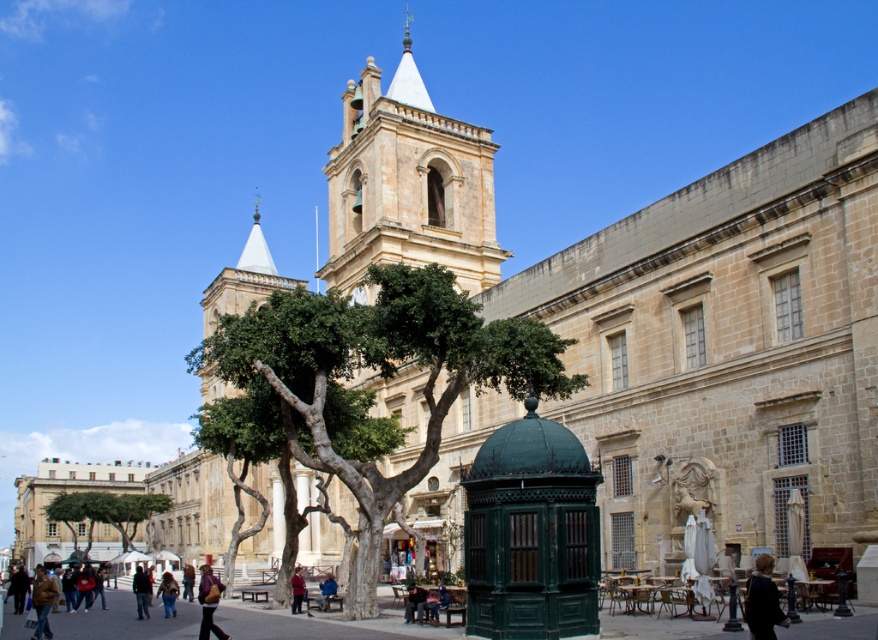
Question: Does light beige stone tower at center have a greater width compared to green leafy tree at lower left?

Choices:
 (A) no
 (B) yes

Answer: (B)

Question: Is dark blue jacket at lower right wider than brown leather jacket at lower left?

Choices:
 (A) no
 (B) yes

Answer: (A)

Question: Which of the following is the farthest from the observer?

Choices:
 (A) (141, 618)
 (B) (299, 577)
 (C) (41, 582)

Answer: (B)

Question: Does dark brown leather jacket at lower left appear under red sweater at center?

Choices:
 (A) no
 (B) yes

Answer: (B)

Question: Which object is closer to the camera taking this photo?

Choices:
 (A) leather jacket at lower center
 (B) brown leather jacket at lower left
 (C) blue fabric jacket at lower center
 (D) denim jacket at lower left

Answer: (A)

Question: Which point appears farthest from the camera in this image?

Choices:
 (A) (250, 346)
 (B) (357, 156)

Answer: (B)